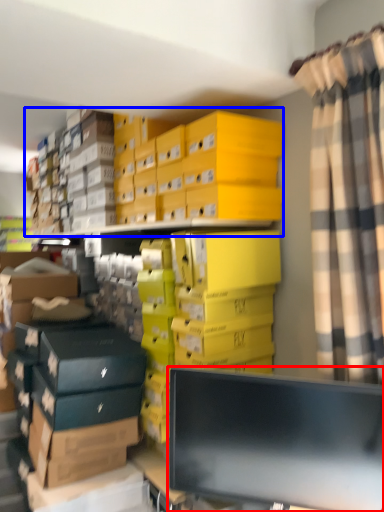
Question: Which object appears closest to the camera in this image, computer monitor (highlighted by a red box) or storage box (highlighted by a blue box)?

Choices:
 (A) computer monitor
 (B) storage box

Answer: (A)